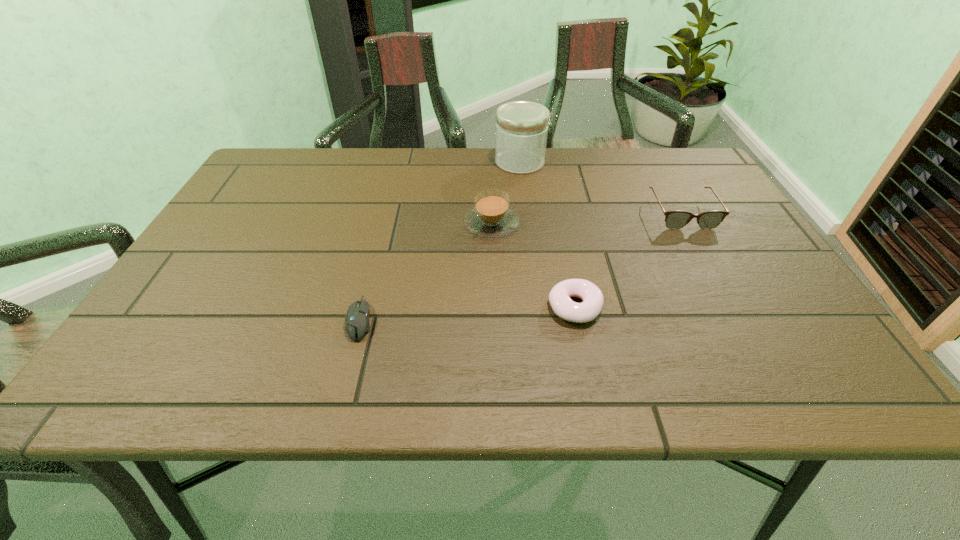
Select which object appears as the closest to the tallest object. Please provide its 2D coordinates. Your answer should be formatted as a tuple, i.e. [(x, y)], where the tuple contains the x and y coordinates of a point satisfying the conditions above.

[(491, 217)]